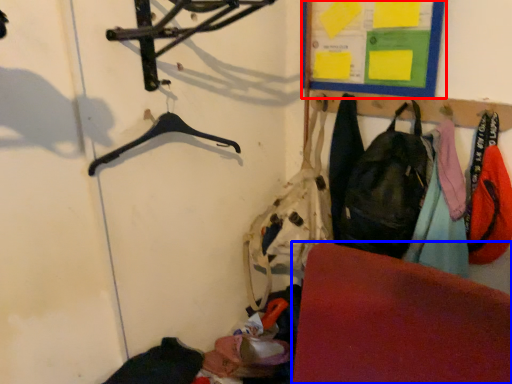
Question: Which object appears closest to the camera in this image, bulletin board (highlighted by a red box) or furniture (highlighted by a blue box)?

Choices:
 (A) bulletin board
 (B) furniture

Answer: (B)